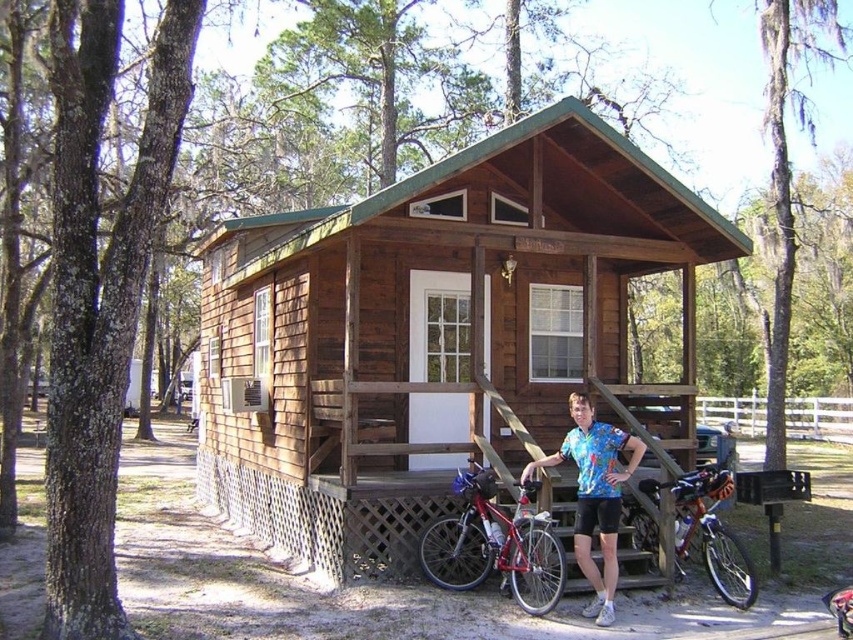
Question: Does brown wooden cabin at center appear under wooden stairs at center?

Choices:
 (A) no
 (B) yes

Answer: (A)

Question: Is wooden stairs at center to the left of shiny metallic bicycle at center from the viewer's perspective?

Choices:
 (A) no
 (B) yes

Answer: (B)

Question: Which is farther from the brown wooden cabin at center?

Choices:
 (A) wooden stairs at center
 (B) shiny red bicycle at center
 (C) blue printed shirt at center
 (D) shiny metallic bicycle at center

Answer: (A)

Question: Which is nearer to the blue printed shirt at center?

Choices:
 (A) shiny red bicycle at center
 (B) shiny metallic bicycle at center
 (C) wooden stairs at center
 (D) brown wooden cabin at center

Answer: (A)

Question: Which of the following is the farthest from the observer?

Choices:
 (A) wooden stairs at center
 (B) blue printed shirt at center

Answer: (A)

Question: Is brown wooden cabin at center further to camera compared to wooden stairs at center?

Choices:
 (A) no
 (B) yes

Answer: (B)